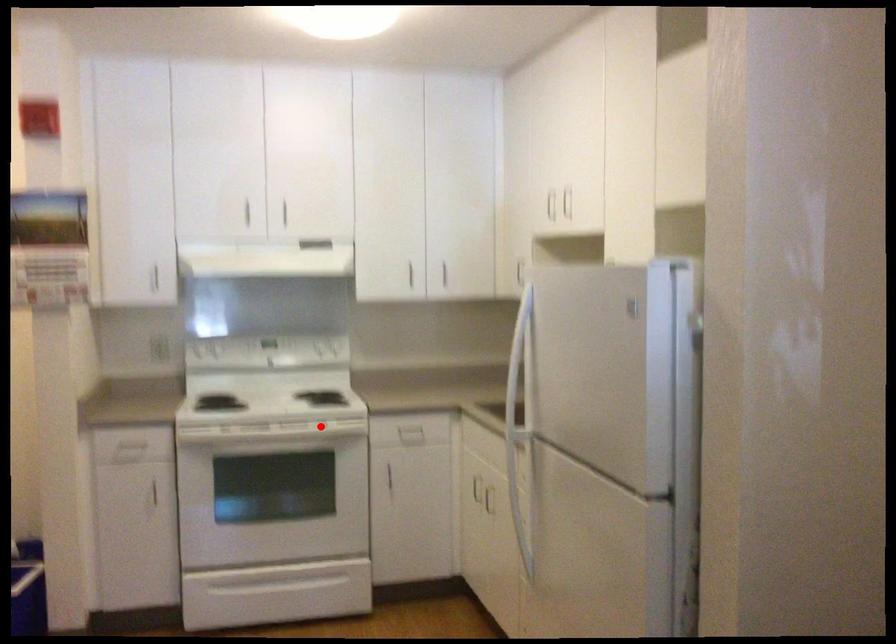
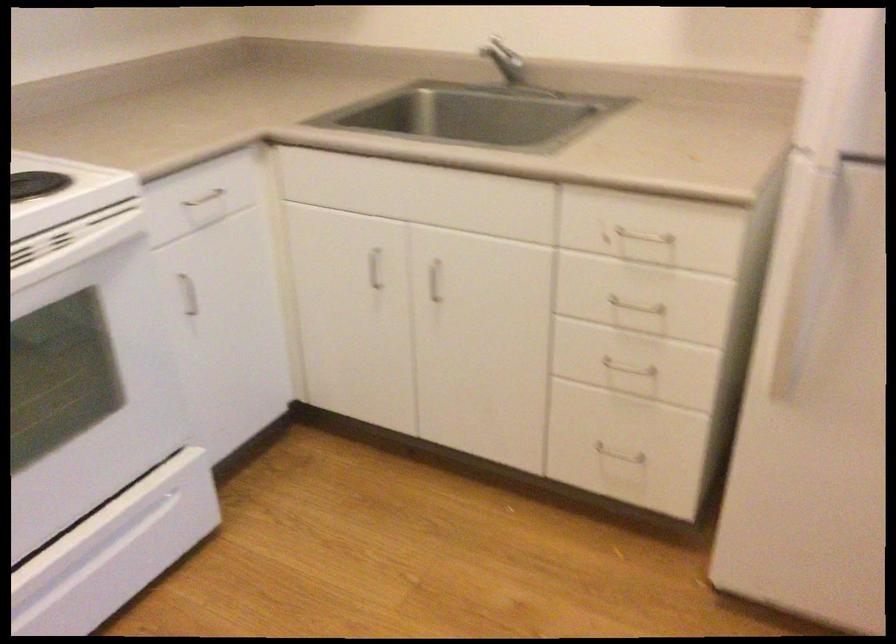
Question: I am providing you with two images of the same scene from different viewpoints. A red point is marked on the first image. Is the red point's position out of view in image 2?

Choices:
 (A) Yes
 (B) No

Answer: (B)